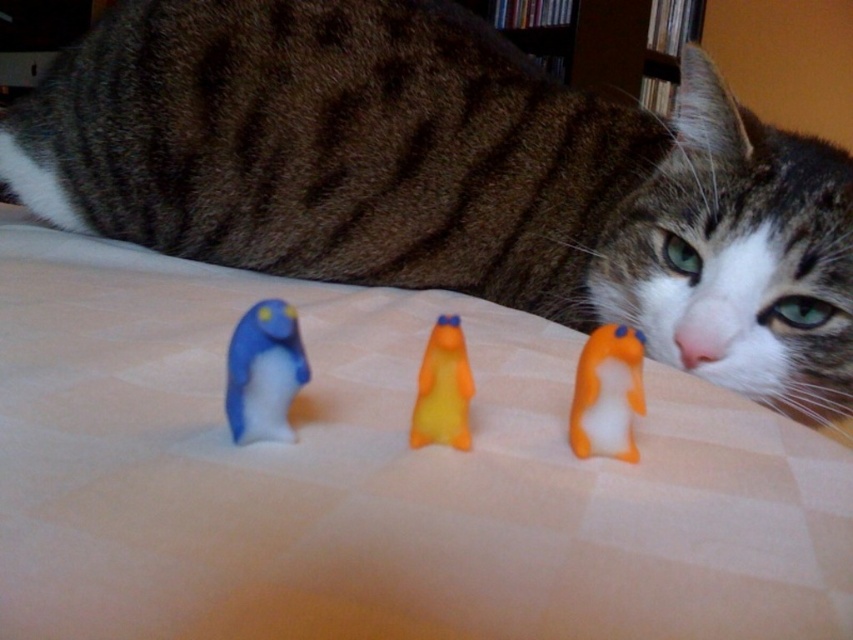
Does blue rubber duck at center have a greater height compared to orange rubber duck at center?

Yes, blue rubber duck at center is taller than orange rubber duck at center.

The width and height of the screenshot is (853, 640). What do you see at coordinates (264, 372) in the screenshot?
I see `blue rubber duck at center` at bounding box center [264, 372].

At what (x,y) coordinates should I click in order to perform the action: click on blue rubber duck at center. Please return your answer as a coordinate pair (x, y). The height and width of the screenshot is (640, 853). Looking at the image, I should click on (264, 372).

Does orange matte plush toy at center appear under orange rubber duck at center?

Yes.

Can you confirm if orange matte plush toy at center is thinner than orange rubber duck at center?

Incorrect, orange matte plush toy at center's width is not less than orange rubber duck at center's.

Who is more forward, [582,353] or [432,374]?

Positioned in front is point [432,374].

The width and height of the screenshot is (853, 640). I want to click on orange matte plush toy at center, so click(x=607, y=394).

Does brown fur cat at upper center have a smaller size compared to blue rubber duck at center?

Actually, brown fur cat at upper center might be larger than blue rubber duck at center.

What do you see at coordinates (451, 179) in the screenshot?
I see `brown fur cat at upper center` at bounding box center [451, 179].

Between point (57, 77) and point (241, 413), which one is positioned behind?

The point (57, 77) is behind.

What are the coordinates of `brown fur cat at upper center` in the screenshot? It's located at (451, 179).